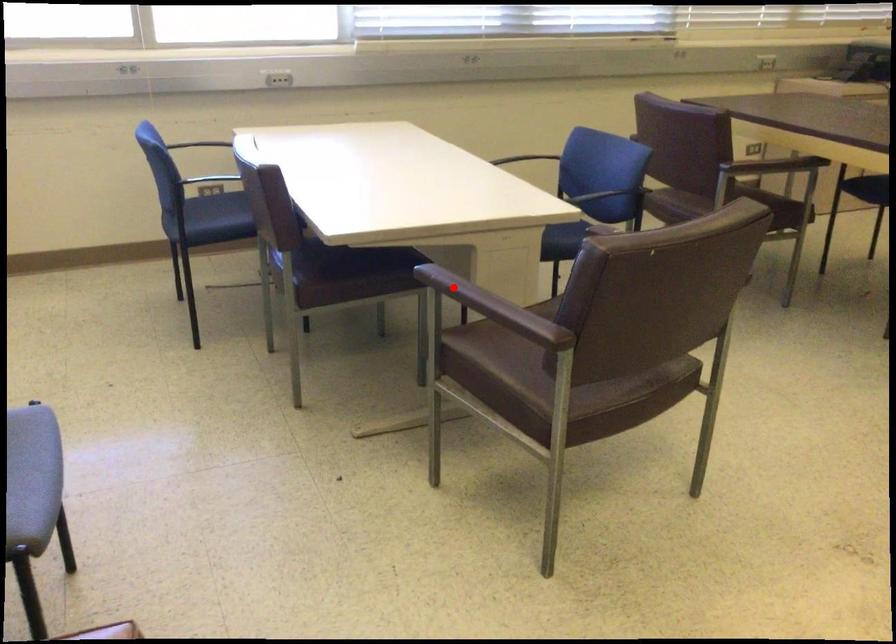
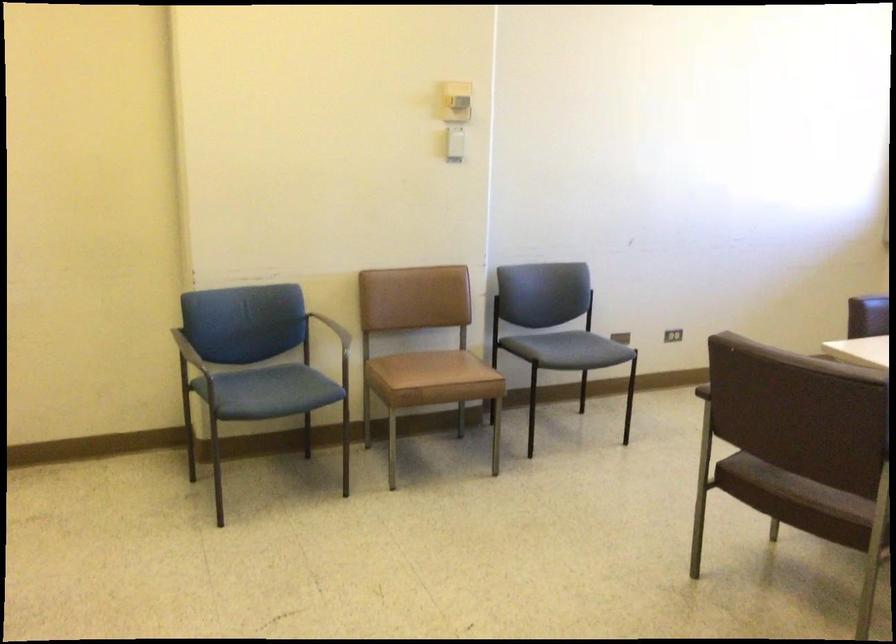
Question: I am providing you with two images of the same scene from different viewpoints. A red point is marked on the first image. Can you still see the location of the red point in image 2?

Choices:
 (A) Yes
 (B) No

Answer: (B)